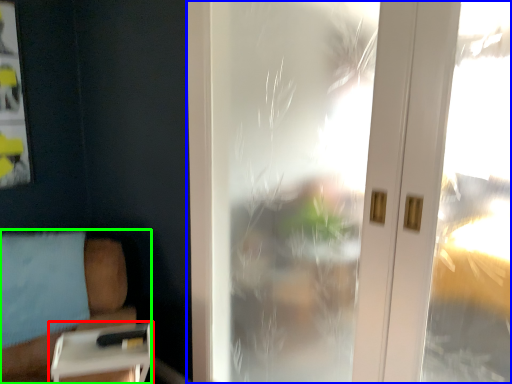
Question: Considering the real-world distances, which object is closest to table (highlighted by a red box)? window (highlighted by a blue box) or furniture (highlighted by a green box).

Choices:
 (A) window
 (B) furniture

Answer: (B)